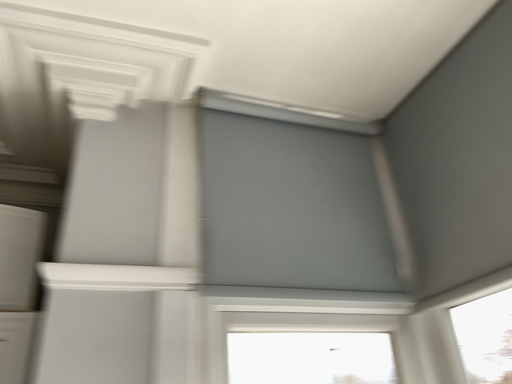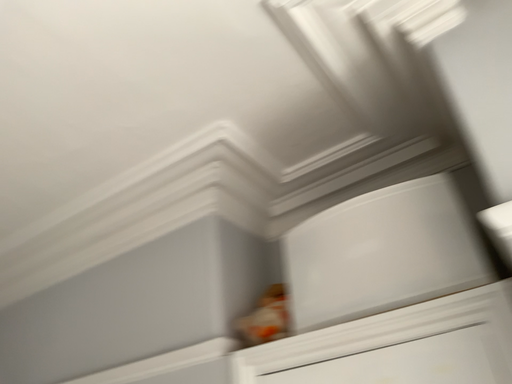
Question: How did the camera likely rotate when shooting the video?

Choices:
 (A) rotated right
 (B) rotated left

Answer: (B)